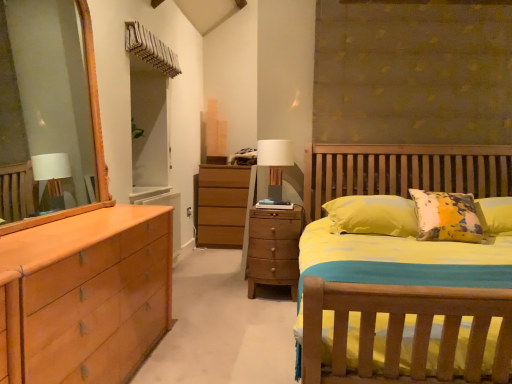
Where is `white fabric-covered table lamp at center`? This screenshot has width=512, height=384. white fabric-covered table lamp at center is located at coordinates (275, 163).

What do you see at coordinates (275, 163) in the screenshot? I see `white fabric-covered table lamp at center` at bounding box center [275, 163].

From the picture: Measure the distance between matte brown chest of drawers at center and camera.

3.17 meters.

Describe the element at coordinates (274, 248) in the screenshot. I see `matte brown chest of drawers at center` at that location.

Locate an element on the screen. The width and height of the screenshot is (512, 384). matte brown chest of drawers at center is located at coordinates (274, 248).

The height and width of the screenshot is (384, 512). I want to click on white fabric-covered table lamp at center, so click(x=275, y=163).

Considering the positions of objects white fabric-covered table lamp at center and matte brown chest of drawers at center in the image provided, who is more to the right, white fabric-covered table lamp at center or matte brown chest of drawers at center?

matte brown chest of drawers at center.

Is the depth of white fabric-covered table lamp at center greater than that of matte brown chest of drawers at center?

Yes, white fabric-covered table lamp at center is further from the camera.

Is point (262, 143) behind point (268, 215)?

Yes.

From the image's perspective, which is above, white fabric-covered table lamp at center or matte brown chest of drawers at center?

white fabric-covered table lamp at center appears higher in the image.

From a real-world perspective, which object rests below the other?

matte brown chest of drawers at center.

In terms of width, does white fabric-covered table lamp at center look wider or thinner when compared to matte brown chest of drawers at center?

Clearly, white fabric-covered table lamp at center has less width compared to matte brown chest of drawers at center.

Is white fabric-covered table lamp at center shorter than matte brown chest of drawers at center?

Yes, white fabric-covered table lamp at center is shorter than matte brown chest of drawers at center.

Is white fabric-covered table lamp at center bigger or smaller than matte brown chest of drawers at center?

white fabric-covered table lamp at center is smaller than matte brown chest of drawers at center.

Is white fabric-covered table lamp at center completely or partially outside of matte brown chest of drawers at center?

Yes.

Is white fabric-covered table lamp at center in contact with matte brown chest of drawers at center?

No, white fabric-covered table lamp at center is not with matte brown chest of drawers at center.

Could you tell me if white fabric-covered table lamp at center is turned towards matte brown chest of drawers at center?

No, white fabric-covered table lamp at center is not oriented towards matte brown chest of drawers at center.

Can you tell me how much white fabric-covered table lamp at center and matte brown chest of drawers at center differ in facing direction?

white fabric-covered table lamp at center and matte brown chest of drawers at center are facing 0.000556 degrees away from each other.

Measure the distance from white fabric-covered table lamp at center to matte brown chest of drawers at center.

A distance of 16.15 inches exists between white fabric-covered table lamp at center and matte brown chest of drawers at center.

Image resolution: width=512 pixels, height=384 pixels. I want to click on the chest of drawers below the white fabric-covered table lamp at center (from a real-world perspective), so click(x=274, y=248).

Considering the relative positions of matte brown chest of drawers at center and white fabric-covered table lamp at center in the image provided, is matte brown chest of drawers at center to the right of white fabric-covered table lamp at center from the viewer's perspective?

Indeed, matte brown chest of drawers at center is positioned on the right side of white fabric-covered table lamp at center.

Is matte brown chest of drawers at center positioned before white fabric-covered table lamp at center?

That is True.

Which is nearer, (278,217) or (279,160)?

Point (278,217) appears to be closer to the viewer than point (279,160).

From the image's perspective, who appears lower, matte brown chest of drawers at center or white fabric-covered table lamp at center?

matte brown chest of drawers at center appears lower in the image.

From a real-world perspective, is matte brown chest of drawers at center physically above white fabric-covered table lamp at center?

No, from a real-world perspective, matte brown chest of drawers at center is not over white fabric-covered table lamp at center

Is matte brown chest of drawers at center thinner than white fabric-covered table lamp at center?

In fact, matte brown chest of drawers at center might be wider than white fabric-covered table lamp at center.

Can you confirm if matte brown chest of drawers at center is shorter than white fabric-covered table lamp at center?

No, matte brown chest of drawers at center is not shorter than white fabric-covered table lamp at center.

Is matte brown chest of drawers at center smaller than white fabric-covered table lamp at center?

No, matte brown chest of drawers at center is not smaller than white fabric-covered table lamp at center.

Is matte brown chest of drawers at center inside the boundaries of white fabric-covered table lamp at center, or outside?

matte brown chest of drawers at center is not inside white fabric-covered table lamp at center, it's outside.

Are matte brown chest of drawers at center and white fabric-covered table lamp at center located far from each other?

No, matte brown chest of drawers at center is not far away from white fabric-covered table lamp at center.

Is matte brown chest of drawers at center turned away from white fabric-covered table lamp at center?

That's not correct — matte brown chest of drawers at center is not looking away from white fabric-covered table lamp at center.

What's the angular difference between matte brown chest of drawers at center and white fabric-covered table lamp at center's facing directions?

0.000556 degrees separate the facing orientations of matte brown chest of drawers at center and white fabric-covered table lamp at center.

Measure the distance between matte brown chest of drawers at center and white fabric-covered table lamp at center.

The distance of matte brown chest of drawers at center from white fabric-covered table lamp at center is 16.15 inches.

You are a GUI agent. You are given a task and a screenshot of the screen. Output one action in this format:
    pyautogui.click(x=<x>, y=<y>)
    Task: Click on the table lamp behind the matte brown chest of drawers at center
    This screenshot has width=512, height=384.
    Given the screenshot: What is the action you would take?
    pyautogui.click(x=275, y=163)

The width and height of the screenshot is (512, 384). I want to click on table lamp behind the matte brown chest of drawers at center, so click(x=275, y=163).

Locate an element on the screen. chest of drawers lying on the right of white fabric-covered table lamp at center is located at coordinates (274, 248).